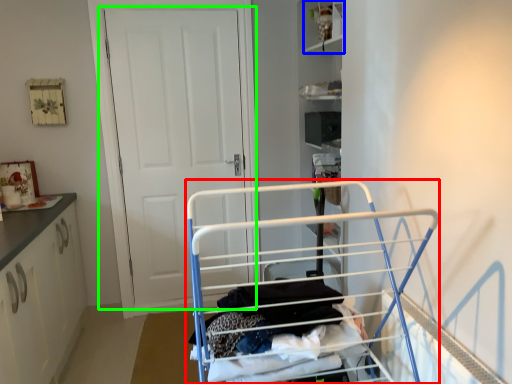
Question: Estimate the real-world distances between objects in this image. Which object is farther from baby carriage (highlighted by a red box), cabinet (highlighted by a blue box) or door (highlighted by a green box)?

Choices:
 (A) cabinet
 (B) door

Answer: (A)